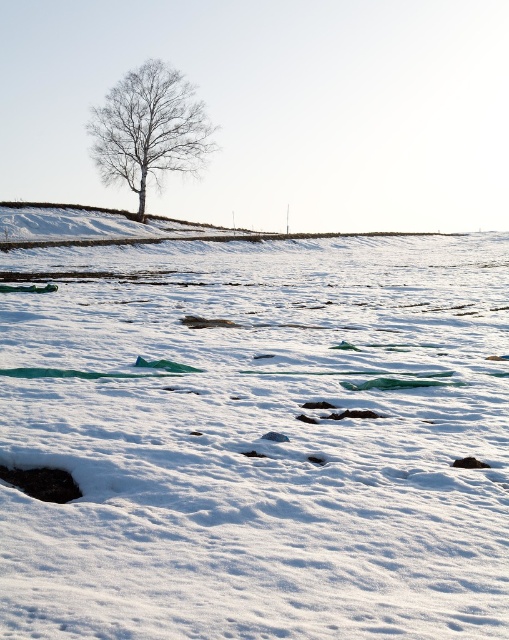
Question: From the image, what is the correct spatial relationship of white powdery snow at center in relation to bare white tree at center?

Choices:
 (A) left
 (B) right

Answer: (B)

Question: Which point is farther from the camera taking this photo?

Choices:
 (A) (501, 294)
 (B) (140, 189)

Answer: (B)

Question: Does white powdery snow at center have a greater width compared to bare white tree at center?

Choices:
 (A) yes
 (B) no

Answer: (A)

Question: Which of the following is the farthest from the observer?

Choices:
 (A) bare white tree at center
 (B) white powdery snow at center

Answer: (A)

Question: Can you confirm if white powdery snow at center is positioned to the right of bare white tree at center?

Choices:
 (A) no
 (B) yes

Answer: (B)